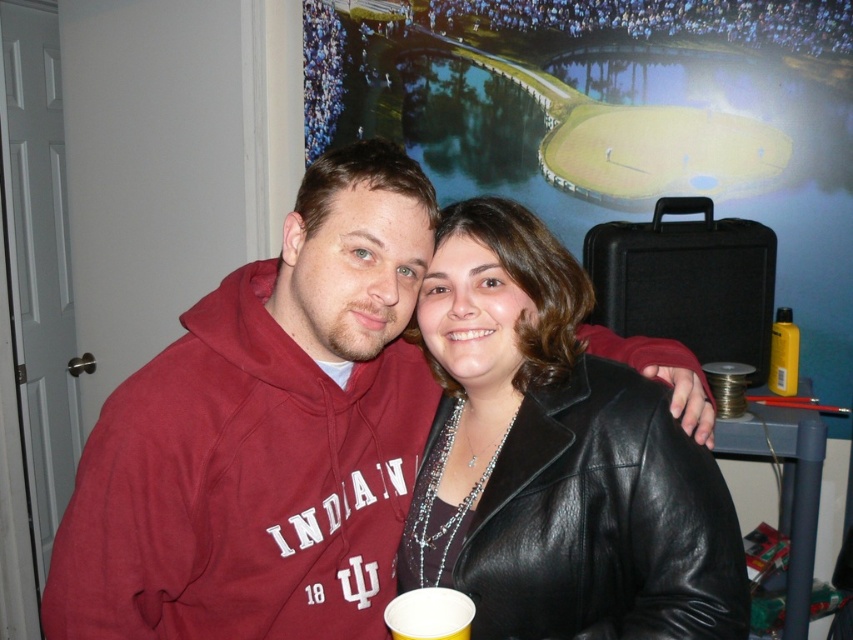
You are a photographer trying to capture a shot of the maroon hoodie at center and the white paper cup at lower center. Which object should you focus on first if you want to start with the one closer to the camera?

The maroon hoodie at center is to the left of the white paper cup at lower center, so focusing on the maroon hoodie at center first would be appropriate as it is closer to the camera.

You are a photographer setting up a wide shot to capture both the maroon hoodie at center and the black leather jacket at center in the frame. Based on their positions and sizes, do you think you can fit both comfortably in the current camera frame without needing to adjust your position?

The maroon hoodie at center might be wider than black leather jacket at center, so there might be enough space to fit both comfortably in the current camera frame without needing to adjust your position.

You are organizing a charity event and need to decide which item to place on a shelf that can only hold items narrower than the maroon hoodie at center. Can the white paper cup at lower center fit on the shelf?

Result: The maroon hoodie at center is wider than the white paper cup at lower center, so the white paper cup at lower center can fit on the shelf since it is narrower.